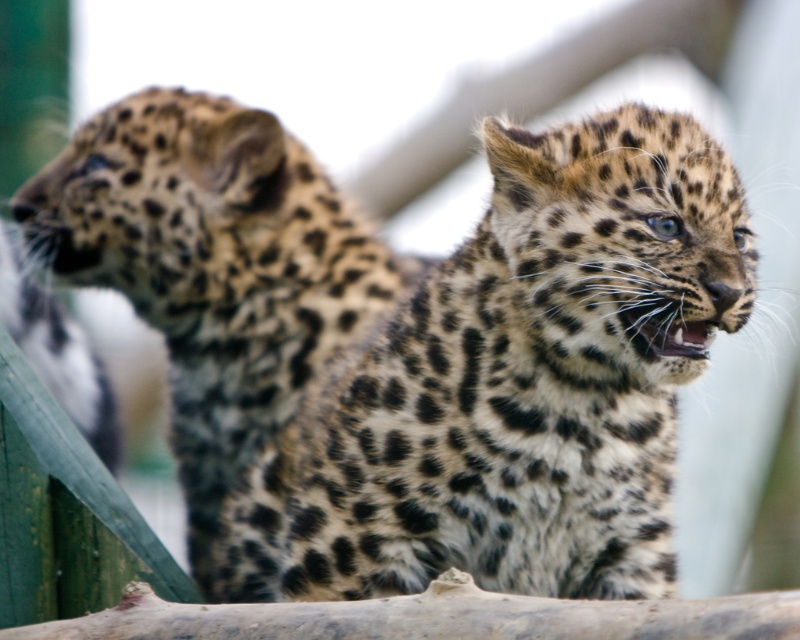
You are a zookeeper observing two spotted fur cheetahs in their enclosure. The spotted fur cheetah at center and the spotted fur cheetah at left are both visible. Which of the two cheetahs is bigger?

The spotted fur cheetah at center is larger in size compared to the spotted fur cheetah at left.

You are a zookeeper standing at the camera position. You want to feed the spotted fur cheetah at center. The feeding tool you have can reach up to 6 meters. Can you reach the cheetah with the tool?

The spotted fur cheetah at center and camera are 5.88 meters apart from each other. Since the feeding tool can reach up to 6 meters, you can reach the cheetah with the tool.